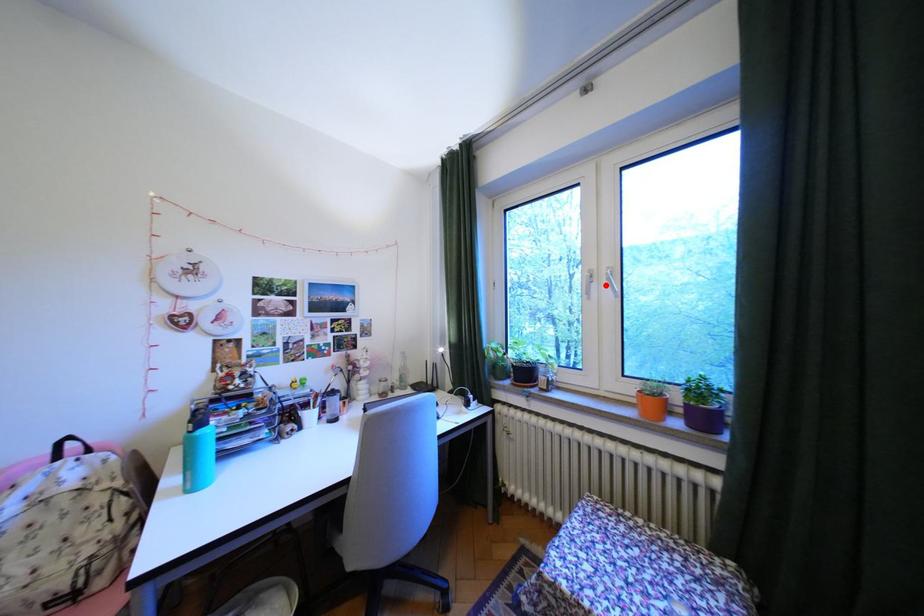
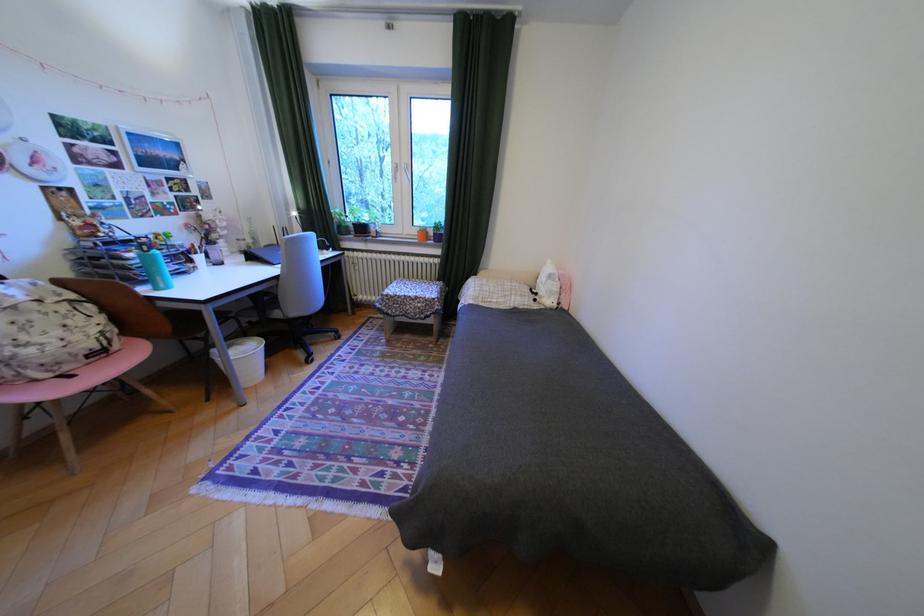
Question: I am providing you with two images of the same scene from different viewpoints. Given a red point in image1, look at the same physical point in image2. Is it:

Choices:
 (A) Closer to the viewpoint
 (B) Farther from the viewpoint

Answer: (A)